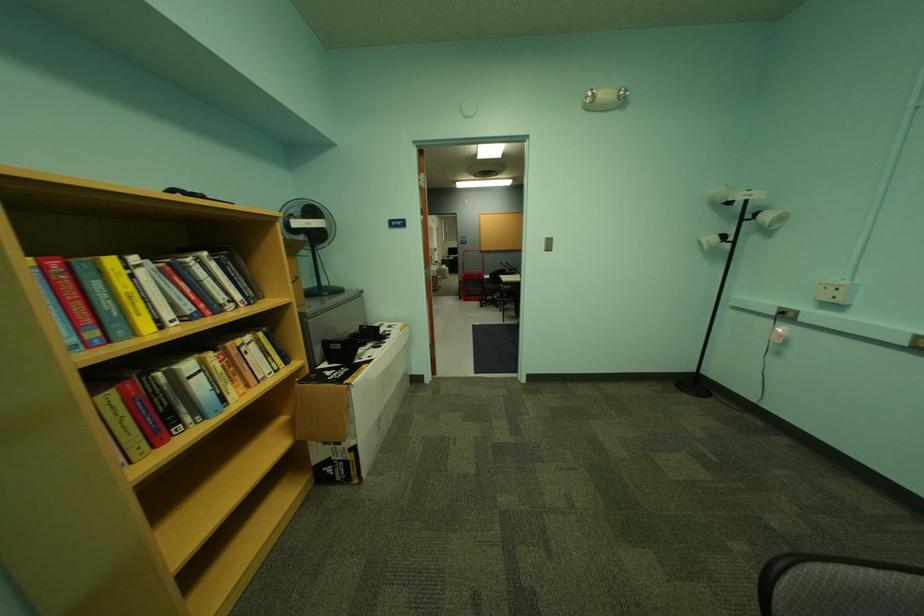
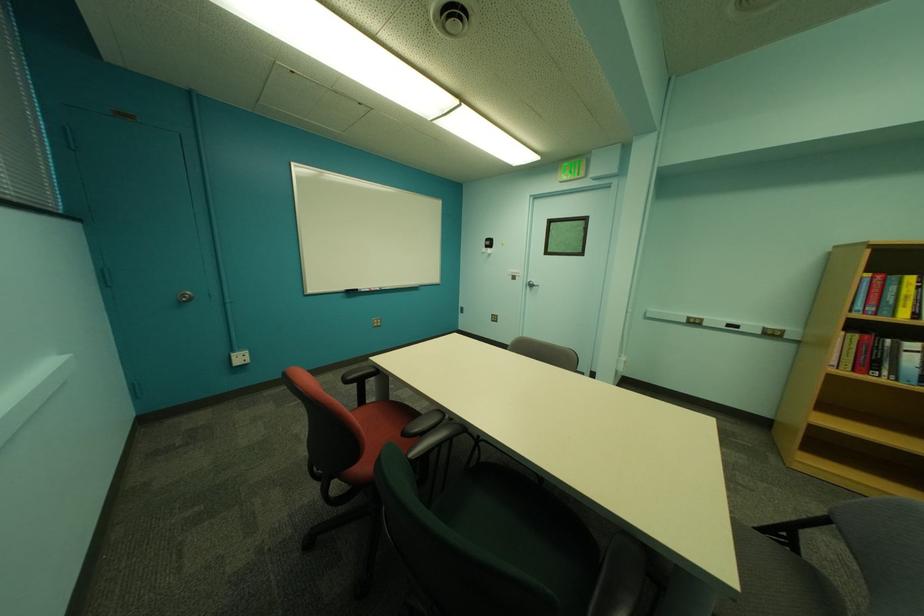
Find the pixel in the second image that matches the point at 103,334 in the first image.

(881, 310)